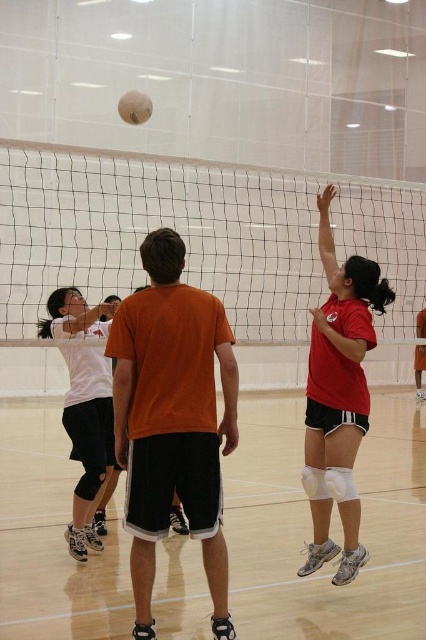
Question: Which of the following is the closest to the observer?

Choices:
 (A) beige fabric volleyball at upper center
 (B) white matte shirt at center
 (C) white mesh net at center

Answer: (C)

Question: Which object is the closest to the matte red shirt at right?

Choices:
 (A) white mesh net at center
 (B) white matte shirt at center

Answer: (B)

Question: Can you confirm if matte red shirt at right is positioned below beige fabric volleyball at upper center?

Choices:
 (A) no
 (B) yes

Answer: (B)

Question: Does white matte knee pads at center have a larger size compared to matte red shirt at right?

Choices:
 (A) yes
 (B) no

Answer: (A)

Question: Can you confirm if white matte knee pads at center is wider than white matte shirt at center?

Choices:
 (A) no
 (B) yes

Answer: (B)

Question: Estimate the real-world distances between objects in this image. Which object is closer to the white mesh net at center?

Choices:
 (A) beige fabric volleyball at upper center
 (B) white matte knee pads at center
 (C) matte red shirt at right
 (D) white matte shirt at center

Answer: (B)